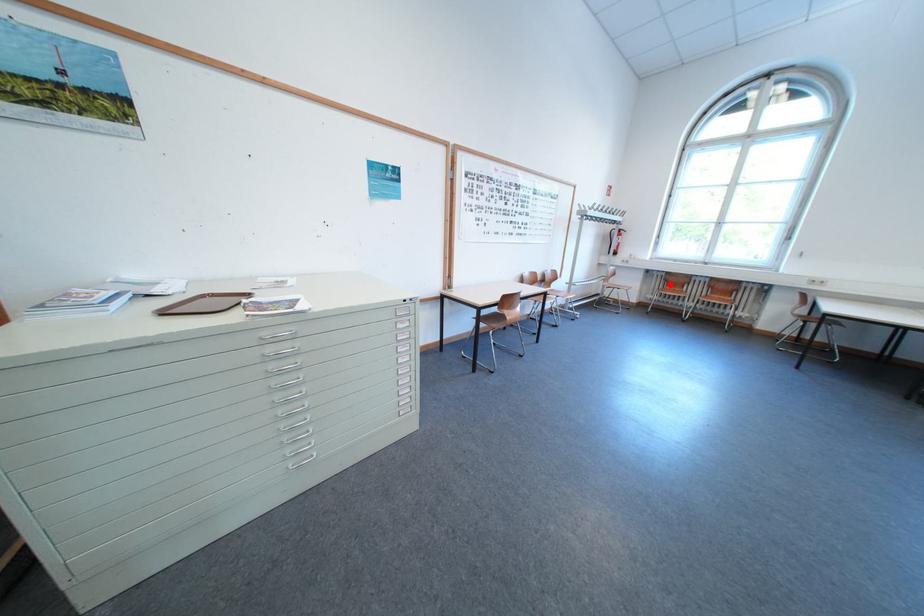
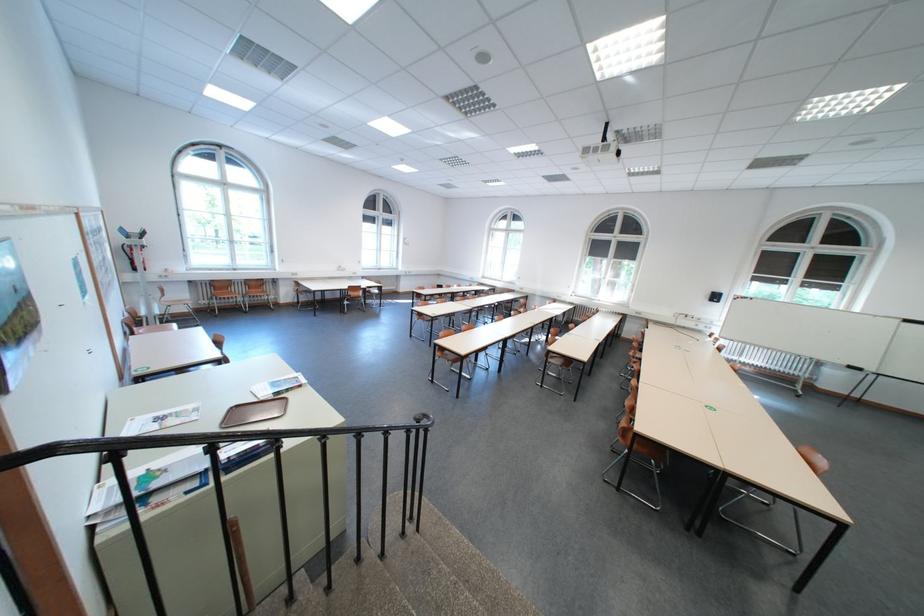
Question: I am providing you with two images of the same scene from different viewpoints. In image1, a red point is highlighted. Considering the same 3D point in image2, which of the following is correct?

Choices:
 (A) It is closer
 (B) It is farther

Answer: (B)